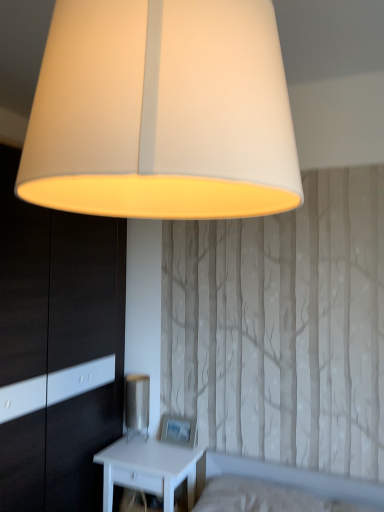
The height and width of the screenshot is (512, 384). What are the coordinates of `empty space that is ontop of white matte nightstand at lower left (from a real-world perspective)` in the screenshot? It's located at (142, 446).